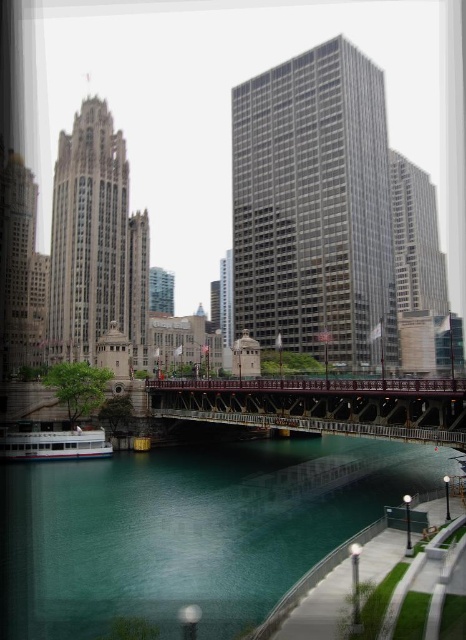
Who is more forward, (105, 147) or (9, 445)?

Point (9, 445) is more forward.

Where is `beige stone tower at left`? The width and height of the screenshot is (466, 640). beige stone tower at left is located at coordinates (95, 243).

Which is above, teal glassy river at center or white matte boat at lower left?

white matte boat at lower left

Does teal glassy river at center appear on the right side of white matte boat at lower left?

Yes, teal glassy river at center is to the right of white matte boat at lower left.

Image resolution: width=466 pixels, height=640 pixels. What do you see at coordinates (189, 529) in the screenshot?
I see `teal glassy river at center` at bounding box center [189, 529].

Where is `teal glassy river at center`? Image resolution: width=466 pixels, height=640 pixels. teal glassy river at center is located at coordinates (189, 529).

Between teal glassy river at center and gray glass skyscraper at center, which one appears on the left side from the viewer's perspective?

teal glassy river at center is more to the left.

Between teal glassy river at center and gray glass skyscraper at center, which one has less height?

With less height is teal glassy river at center.

Does point (156, 532) lie in front of point (328, 200)?

Yes, it is.

At what (x,y) coordinates should I click in order to perform the action: click on teal glassy river at center. Please return your answer as a coordinate pair (x, y). The height and width of the screenshot is (640, 466). Looking at the image, I should click on (189, 529).